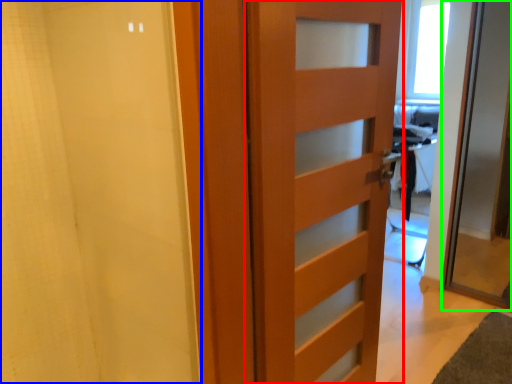
Question: Which object is positioned farthest from door (highlighted by a red box)? Select from shower curtain (highlighted by a blue box) and door (highlighted by a green box).

Choices:
 (A) shower curtain
 (B) door

Answer: (B)